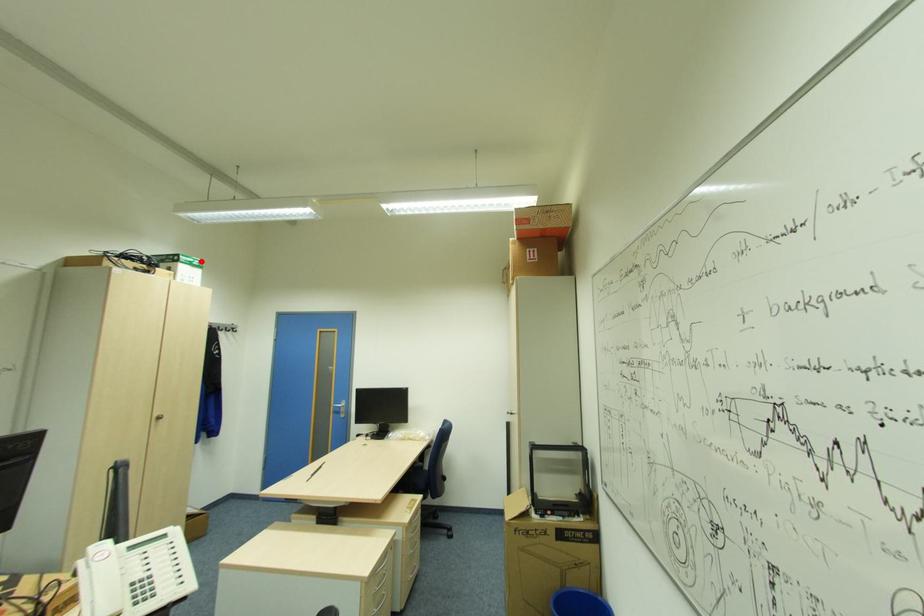
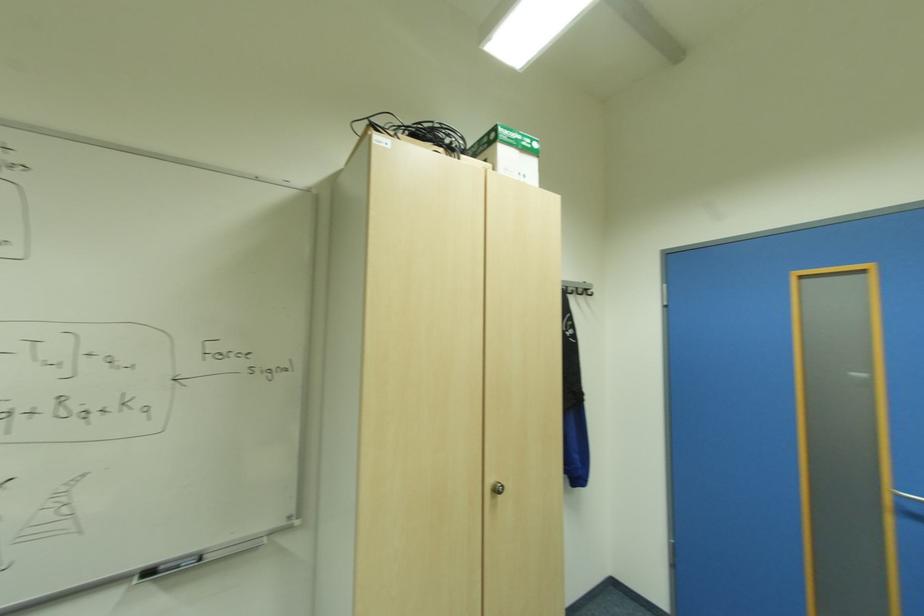
Where in the second image is the point corresponding to the highlighted location from the first image?

(533, 140)